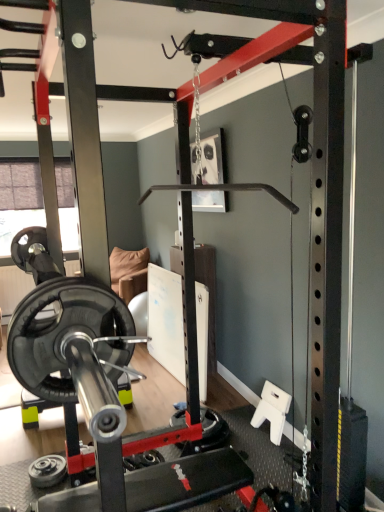
Question: Considering the positions of point (44, 477) and point (208, 412), is point (44, 477) closer or farther from the camera than point (208, 412)?

Choices:
 (A) farther
 (B) closer

Answer: (B)

Question: From a real-world perspective, is black rubber weight plate at lower left, which is the first wheel from left to right, positioned above or below black rubber wheel at center, placed as the first wheel when sorted from top to bottom?

Choices:
 (A) below
 (B) above

Answer: (A)

Question: Based on their relative distances, which object is farther from the black rubber weight plate at lower left, placed as the first wheel when sorted from front to back?

Choices:
 (A) black rubber wheel at center, placed as the first wheel when sorted from top to bottom
 (B) black rubber barbell at center

Answer: (A)

Question: Which is farther from the black rubber weight plate at lower left, positioned as the 2th wheel in right-to-left order?

Choices:
 (A) black rubber wheel at center, which is counted as the first wheel, starting from the back
 (B) black rubber barbell at center

Answer: (A)